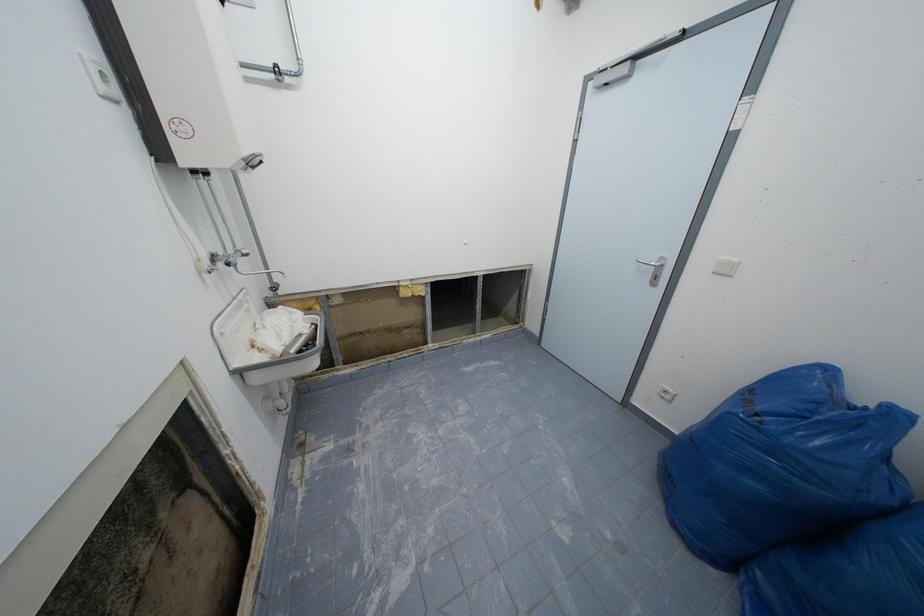
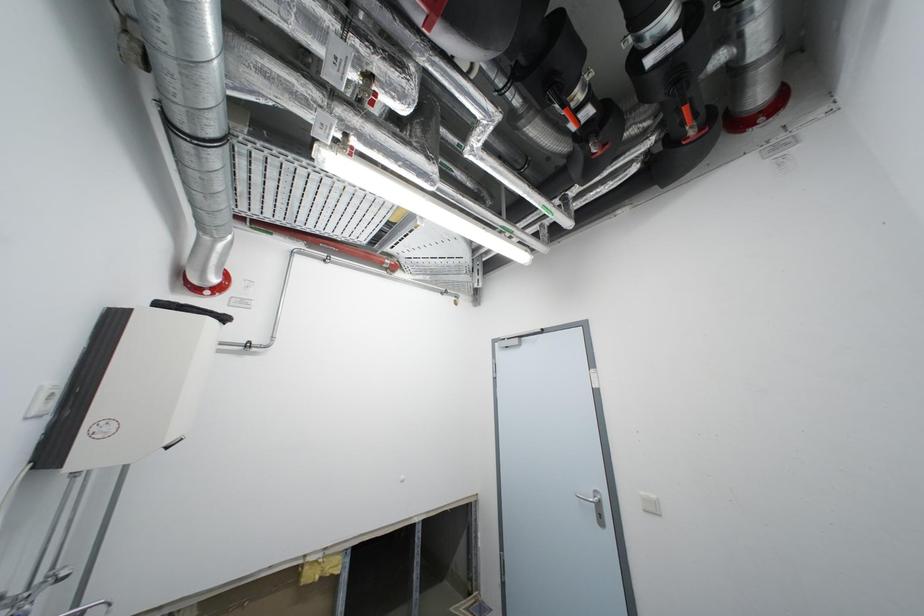
How did the camera likely rotate?

The rotation direction of the camera is right-up.